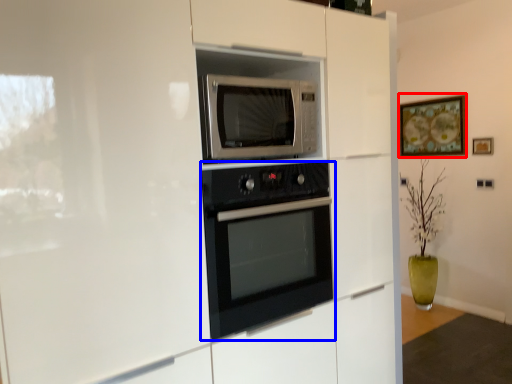
Question: Which object appears farthest to the camera in this image, picture frame (highlighted by a red box) or oven (highlighted by a blue box)?

Choices:
 (A) picture frame
 (B) oven

Answer: (A)